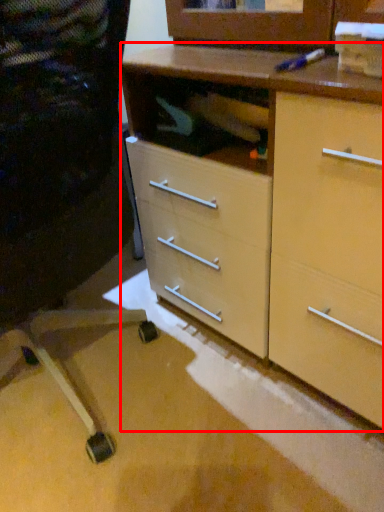
Question: From the image's perspective, what is the correct spatial positioning of chest of drawers (annotated by the red box) in reference to computer chair?

Choices:
 (A) above
 (B) below

Answer: (A)